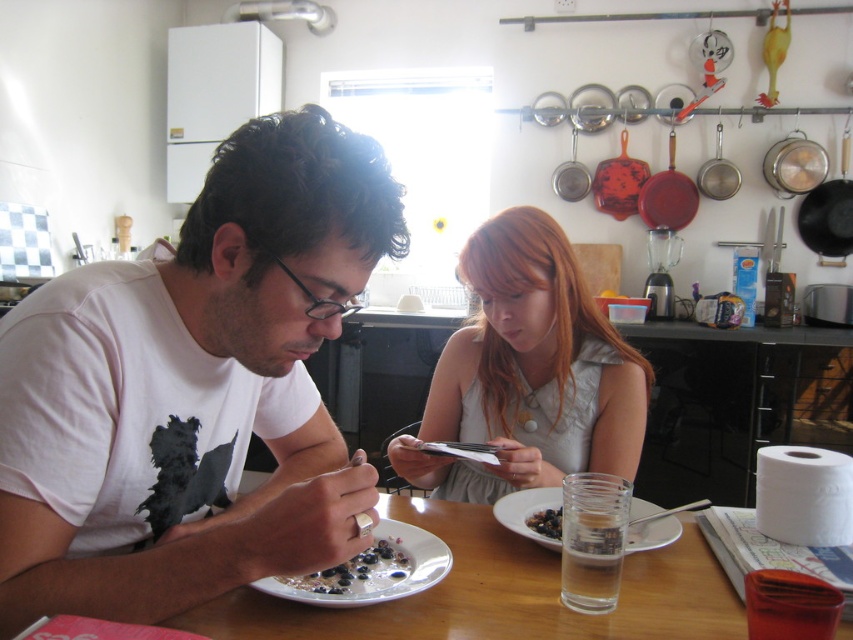
You are standing in the kitchen and want to place a new decoration on the table. There are two points on the table marked as point (322,593) and point (537,525). Which point is closer to you?

Point (322,593) is closer to the viewer than point (537,525), so you should place the decoration there if you want it nearer to you.